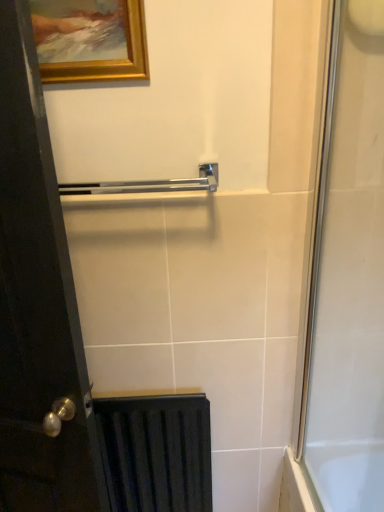
I want to click on gold wooden picture frame at upper left, so click(x=90, y=40).

Describe the element at coordinates (149, 184) in the screenshot. I see `polished chrome towel bar at center` at that location.

Describe the element at coordinates (349, 273) in the screenshot. I see `clear glass shower door at right` at that location.

The image size is (384, 512). I want to click on matte black radiator at lower left, so click(156, 452).

You are a GUI agent. You are given a task and a screenshot of the screen. Output one action in this format:
    pyautogui.click(x=<x>, y=<y>)
    Task: Click on the gold wooden picture frame at upper left
    The height and width of the screenshot is (512, 384).
    Given the screenshot: What is the action you would take?
    pyautogui.click(x=90, y=40)

From the image's perspective, relative to gold wooden picture frame at upper left, is matte black radiator at lower left above or below?

Clearly, from the image's perspective, matte black radiator at lower left is below gold wooden picture frame at upper left.

From a real-world perspective, which is physically above, matte black radiator at lower left or gold wooden picture frame at upper left?

In real-world perspective, gold wooden picture frame at upper left is above.

Is gold wooden picture frame at upper left at the back of matte black radiator at lower left?

matte black radiator at lower left is not turned away from gold wooden picture frame at upper left.

Is black wood door at left situated inside polished chrome towel bar at center or outside?

black wood door at left is outside polished chrome towel bar at center.

Is point (35, 76) less distant than point (62, 193)?

Yes, it is in front of point (62, 193).

How many degrees apart are the facing directions of black wood door at left and polished chrome towel bar at center?

The angular difference between black wood door at left and polished chrome towel bar at center is 17.5 degrees.

Is black wood door at left oriented towards polished chrome towel bar at center?

No, black wood door at left is not turned towards polished chrome towel bar at center.

Would you say clear glass shower door at right is inside or outside matte black radiator at lower left?

clear glass shower door at right cannot be found inside matte black radiator at lower left.

Locate an element on the screen. screen door that appears above the matte black radiator at lower left (from a real-world perspective) is located at coordinates (349, 273).

Which is in front, clear glass shower door at right or matte black radiator at lower left?

clear glass shower door at right.

From the image's perspective, which one is positioned lower, clear glass shower door at right or matte black radiator at lower left?

matte black radiator at lower left, from the image's perspective.

Looking at this image, from the image's perspective, relative to polished chrome towel bar at center, is matte black radiator at lower left above or below?

Clearly, from the image's perspective, matte black radiator at lower left is below polished chrome towel bar at center.

Can you tell me how much matte black radiator at lower left and polished chrome towel bar at center differ in facing direction?

The angle between the facing direction of matte black radiator at lower left and the facing direction of polished chrome towel bar at center is 0.00398 degrees.

At what (x,y) coordinates should I click in order to perform the action: click on radiator behind the polished chrome towel bar at center. Please return your answer as a coordinate pair (x, y). Image resolution: width=384 pixels, height=512 pixels. Looking at the image, I should click on (156, 452).

Is matte black radiator at lower left turned away from polished chrome towel bar at center?

That's not correct — matte black radiator at lower left is not looking away from polished chrome towel bar at center.

This screenshot has width=384, height=512. I want to click on screen door on the right of polished chrome towel bar at center, so point(349,273).

From a real-world perspective, is polished chrome towel bar at center positioned under clear glass shower door at right based on gravity?

No, from a real-world perspective, polished chrome towel bar at center is not below clear glass shower door at right.

Is the surface of black wood door at left in direct contact with matte black radiator at lower left?

black wood door at left and matte black radiator at lower left are not in contact.

Does point (30, 451) lie behind point (201, 447)?

No, (30, 451) is closer to viewer.

Where is `radiator that is behind the black wood door at left`? radiator that is behind the black wood door at left is located at coordinates (156, 452).

Would you say black wood door at left contains matte black radiator at lower left?

No, matte black radiator at lower left is not a part of black wood door at left.

Where is `towel bar below the gold wooden picture frame at upper left (from a real-world perspective)`? towel bar below the gold wooden picture frame at upper left (from a real-world perspective) is located at coordinates (149, 184).

How many degrees apart are the facing directions of gold wooden picture frame at upper left and polished chrome towel bar at center?

There is a 0.00888-degree angle between the facing directions of gold wooden picture frame at upper left and polished chrome towel bar at center.

Is gold wooden picture frame at upper left taller than polished chrome towel bar at center?

Indeed, gold wooden picture frame at upper left has a greater height compared to polished chrome towel bar at center.

Where is `picture frame located on the left of matte black radiator at lower left`? picture frame located on the left of matte black radiator at lower left is located at coordinates (90, 40).

The height and width of the screenshot is (512, 384). I want to click on towel bar behind the black wood door at left, so pyautogui.click(x=149, y=184).

Based on their spatial positions, is polished chrome towel bar at center or gold wooden picture frame at upper left further from black wood door at left?

The object further to black wood door at left is gold wooden picture frame at upper left.

Which object lies nearer to the anchor point black wood door at left, gold wooden picture frame at upper left or polished chrome towel bar at center?

polished chrome towel bar at center.

Based on their spatial positions, is matte black radiator at lower left or clear glass shower door at right closer to polished chrome towel bar at center?

clear glass shower door at right is closer to polished chrome towel bar at center.

Based on their spatial positions, is matte black radiator at lower left or gold wooden picture frame at upper left further from polished chrome towel bar at center?

matte black radiator at lower left is further to polished chrome towel bar at center.

Which object lies further to the anchor point gold wooden picture frame at upper left, polished chrome towel bar at center or clear glass shower door at right?

clear glass shower door at right lies further to gold wooden picture frame at upper left than the other object.

Which object lies further to the anchor point black wood door at left, clear glass shower door at right or matte black radiator at lower left?

clear glass shower door at right is further to black wood door at left.

When comparing their distances from clear glass shower door at right, does matte black radiator at lower left or polished chrome towel bar at center seem closer?

matte black radiator at lower left.

Estimate the real-world distances between objects in this image. Which object is closer to black wood door at left, matte black radiator at lower left or polished chrome towel bar at center?

matte black radiator at lower left is positioned closer to the anchor black wood door at left.

This screenshot has height=512, width=384. What are the coordinates of `towel bar between gold wooden picture frame at upper left and clear glass shower door at right in the up-down direction` in the screenshot? It's located at (149, 184).

Identify the location of screen door that lies between gold wooden picture frame at upper left and matte black radiator at lower left from top to bottom. (349, 273).

The height and width of the screenshot is (512, 384). In order to click on towel bar between gold wooden picture frame at upper left and matte black radiator at lower left in the vertical direction in this screenshot , I will do `click(149, 184)`.

At what (x,y) coordinates should I click in order to perform the action: click on door that lies between polished chrome towel bar at center and matte black radiator at lower left from top to bottom. Please return your answer as a coordinate pair (x, y). Looking at the image, I should click on (38, 302).